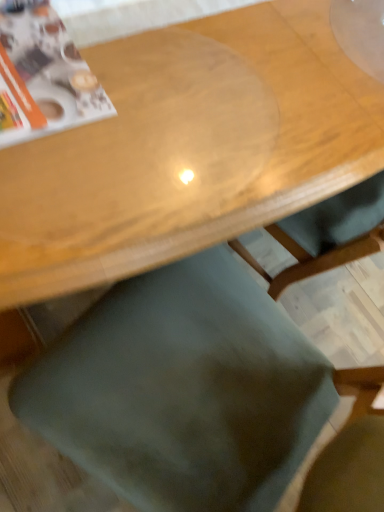
Locate an element on the screen. The width and height of the screenshot is (384, 512). green fabric chair at lower center is located at coordinates (182, 390).

Describe the element at coordinates (188, 148) in the screenshot. I see `transparent plastic table at upper center` at that location.

Where is `green fabric chair at lower center`? This screenshot has width=384, height=512. green fabric chair at lower center is located at coordinates (182, 390).

How distant is green fabric chair at lower center from transparent plastic table at upper center?

The distance of green fabric chair at lower center from transparent plastic table at upper center is 12.82 inches.

Is point (121, 492) positioned in front of point (243, 105)?

No, it is not.

Is green fabric chair at lower center wider or thinner than transparent plastic table at upper center?

green fabric chair at lower center is thinner than transparent plastic table at upper center.

Is green fabric chair at lower center facing towards transparent plastic table at upper center?

Yes, green fabric chair at lower center is aimed at transparent plastic table at upper center.

Between green fabric chair at lower center and matte paper magazine at upper left, which one has less height?

matte paper magazine at upper left is shorter.

Which of these two, green fabric chair at lower center or matte paper magazine at upper left, is smaller?

matte paper magazine at upper left is smaller.

Based on their positions, is green fabric chair at lower center located to the left or right of matte paper magazine at upper left?

green fabric chair at lower center is positioned on matte paper magazine at upper left's right side.

Which of these two, matte paper magazine at upper left or transparent plastic table at upper center, stands shorter?

matte paper magazine at upper left.

Is matte paper magazine at upper left bigger or smaller than transparent plastic table at upper center?

Considering their sizes, matte paper magazine at upper left takes up less space than transparent plastic table at upper center.

Is matte paper magazine at upper left positioned far away from transparent plastic table at upper center?

No, matte paper magazine at upper left is not far from transparent plastic table at upper center.

Does matte paper magazine at upper left turn towards transparent plastic table at upper center?

Yes, matte paper magazine at upper left is facing transparent plastic table at upper center.

Is matte paper magazine at upper left to the left of green fabric chair at lower center from the viewer's perspective?

Yes, matte paper magazine at upper left is to the left of green fabric chair at lower center.

From the image's perspective, between matte paper magazine at upper left and green fabric chair at lower center, who is located below?

green fabric chair at lower center.

Is matte paper magazine at upper left shorter than green fabric chair at lower center?

Indeed, matte paper magazine at upper left has a lesser height compared to green fabric chair at lower center.

In order to click on magazine located above the green fabric chair at lower center (from the image's perspective) in this screenshot , I will do `click(50, 69)`.

Considering the relative positions of transparent plastic table at upper center and matte paper magazine at upper left in the image provided, is transparent plastic table at upper center to the left of matte paper magazine at upper left from the viewer's perspective?

No, transparent plastic table at upper center is not to the left of matte paper magazine at upper left.

From a real-world perspective, is transparent plastic table at upper center beneath matte paper magazine at upper left?

Yes.

You are a GUI agent. You are given a task and a screenshot of the screen. Output one action in this format:
    pyautogui.click(x=<x>, y=<y>)
    Task: Click on the table located on the right of matte paper magazine at upper left
    This screenshot has width=384, height=512.
    Given the screenshot: What is the action you would take?
    pyautogui.click(x=188, y=148)

Can you tell me how much transparent plastic table at upper center and matte paper magazine at upper left differ in facing direction?

transparent plastic table at upper center and matte paper magazine at upper left are facing 92.1 degrees away from each other.

Is transparent plastic table at upper center outside of green fabric chair at lower center?

That's correct, transparent plastic table at upper center is outside of green fabric chair at lower center.

Could you measure the distance between transparent plastic table at upper center and green fabric chair at lower center?

transparent plastic table at upper center and green fabric chair at lower center are 12.82 inches apart from each other.

From the image's perspective, which is below, transparent plastic table at upper center or green fabric chair at lower center?

green fabric chair at lower center appears lower in the image.

Is transparent plastic table at upper center far away from green fabric chair at lower center?

Actually, transparent plastic table at upper center and green fabric chair at lower center are a little close together.

Identify the location of chair in front of the transparent plastic table at upper center. The width and height of the screenshot is (384, 512). (182, 390).

Image resolution: width=384 pixels, height=512 pixels. Find the location of `magazine located above the green fabric chair at lower center (from a real-world perspective)`. magazine located above the green fabric chair at lower center (from a real-world perspective) is located at coordinates (50, 69).

Considering their positions, is green fabric chair at lower center positioned closer to transparent plastic table at upper center than matte paper magazine at upper left?

matte paper magazine at upper left lies closer to transparent plastic table at upper center than the other object.

Which object lies further to the anchor point transparent plastic table at upper center, matte paper magazine at upper left or green fabric chair at lower center?

Among the two, green fabric chair at lower center is located further to transparent plastic table at upper center.

Based on their spatial positions, is transparent plastic table at upper center or matte paper magazine at upper left closer to green fabric chair at lower center?

The object closer to green fabric chair at lower center is transparent plastic table at upper center.

Estimate the real-world distances between objects in this image. Which object is further from green fabric chair at lower center, matte paper magazine at upper left or transparent plastic table at upper center?

matte paper magazine at upper left lies further to green fabric chair at lower center than the other object.

Considering their positions, is transparent plastic table at upper center positioned closer to matte paper magazine at upper left than green fabric chair at lower center?

transparent plastic table at upper center is positioned closer to the anchor matte paper magazine at upper left.

Based on their spatial positions, is green fabric chair at lower center or transparent plastic table at upper center further from matte paper magazine at upper left?

The object further to matte paper magazine at upper left is green fabric chair at lower center.

Locate an element on the screen. This screenshot has width=384, height=512. magazine between transparent plastic table at upper center and green fabric chair at lower center vertically is located at coordinates (50, 69).